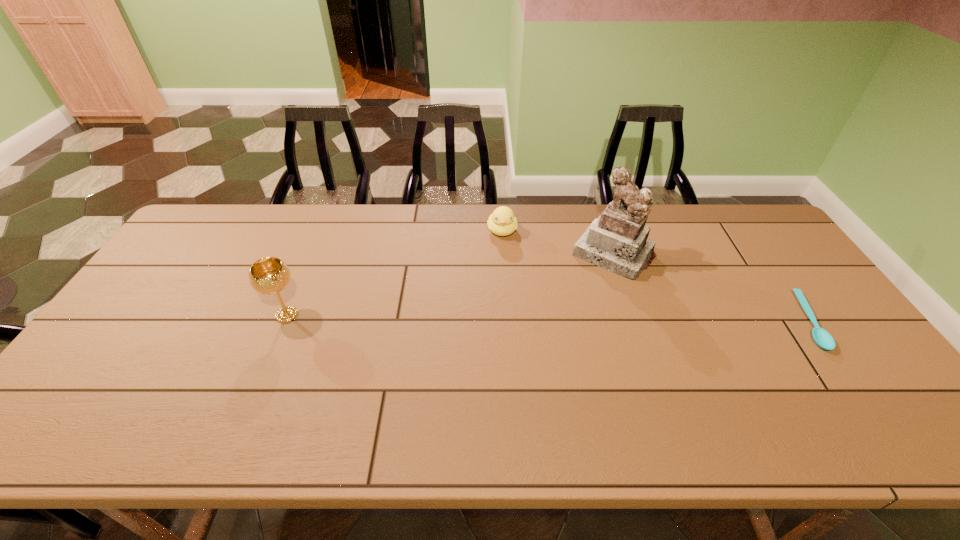
The height and width of the screenshot is (540, 960). I want to click on free space between the rightmost object and the second shortest object, so click(x=655, y=276).

Where is `vacant region between the third object from right to left and the second object from right to left`? The image size is (960, 540). vacant region between the third object from right to left and the second object from right to left is located at coordinates (558, 242).

Image resolution: width=960 pixels, height=540 pixels. In order to click on object that is the third closest one to the rightmost object in this screenshot , I will do `click(270, 275)`.

Identify which object is the second closest to the third tallest object. Please provide its 2D coordinates. Your answer should be formatted as a tuple, i.e. [(x, y)], where the tuple contains the x and y coordinates of a point satisfying the conditions above.

[(270, 275)]

I want to click on free space that satisfies the following two spatial constraints: 1. on the front side of the spoon; 2. on the right side of the second tallest object, so click(284, 321).